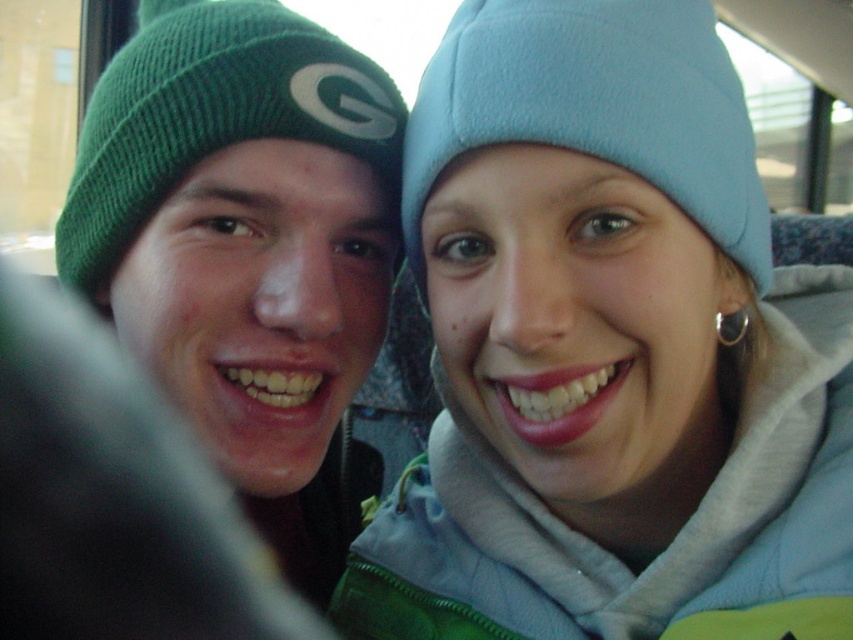
Is light blue fleece beanie at upper right positioned before green knitted beanie at left?

Yes, it is.

How far apart are light blue fleece beanie at upper right and green knitted beanie at left?

light blue fleece beanie at upper right and green knitted beanie at left are 5.94 inches apart from each other.

Who is more distant from viewer, (672, 193) or (138, 108)?

The point (138, 108) is behind.

Identify the location of light blue fleece beanie at upper right. The width and height of the screenshot is (853, 640). (595, 108).